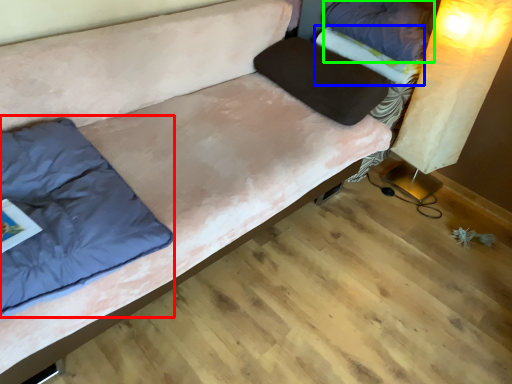
Question: Which is farther away from pillow (highlighted by a red box)? blanket (highlighted by a blue box) or pillow (highlighted by a green box)?

Choices:
 (A) blanket
 (B) pillow

Answer: (B)